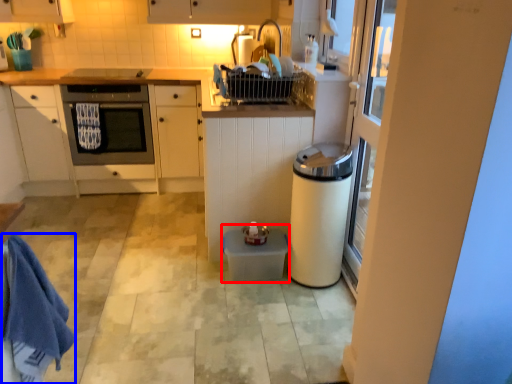
Question: Among these objects, which one is nearest to the camera, water heater (highlighted by a red box) or bath towel (highlighted by a blue box)?

Choices:
 (A) water heater
 (B) bath towel

Answer: (B)